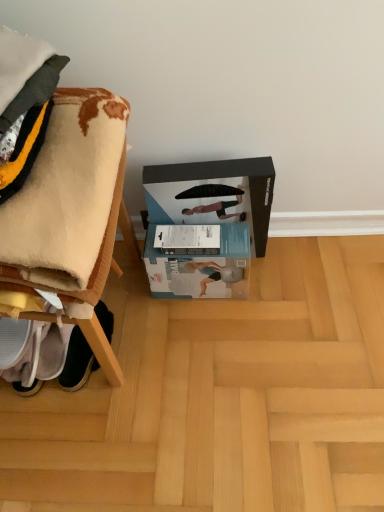
Locate an element on the screen. vacant location behind white fabric shoe at lower left is located at coordinates (124, 283).